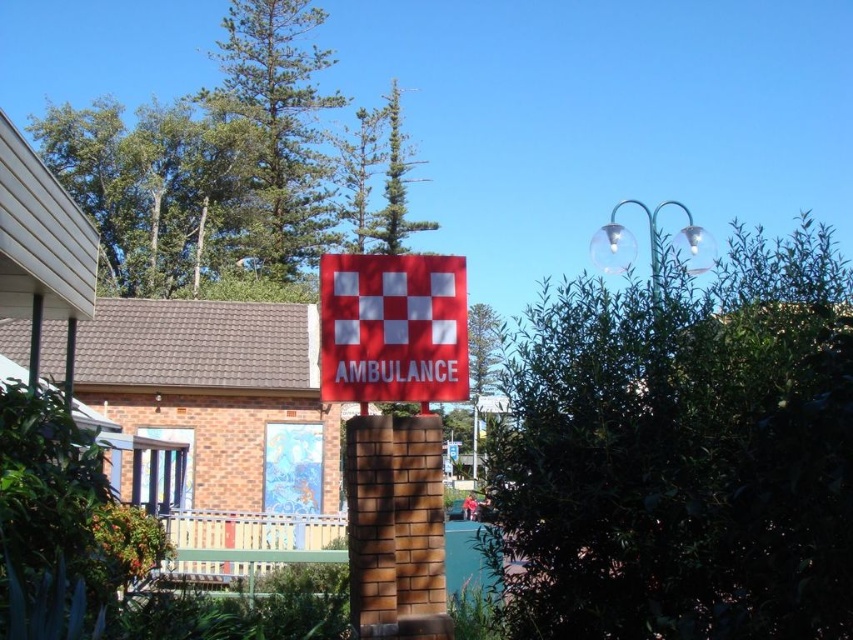
Can you confirm if green leafy tree at upper center is taller than red matte sign at center?

Yes, green leafy tree at upper center is taller than red matte sign at center.

Between point (221, 113) and point (326, 326), which one is positioned in front?

Point (326, 326) is more forward.

Identify the location of green leafy tree at upper center. The image size is (853, 640). (276, 131).

Can you confirm if green leafy bush at center is taller than red matte sign at center?

Yes, green leafy bush at center is taller than red matte sign at center.

Measure the distance between point (581,605) and camera.

The distance of point (581,605) from camera is 2.83 meters.

Is point (555, 500) less distant than point (352, 272)?

Yes.

Locate an element on the screen. The image size is (853, 640). green leafy bush at center is located at coordinates (683, 452).

Does green leafy bush at center have a greater height compared to green leafy tree at upper center?

No.

Which of these two, green leafy bush at center or green leafy tree at upper center, stands taller?

With more height is green leafy tree at upper center.

Where is `green leafy bush at center`? The image size is (853, 640). green leafy bush at center is located at coordinates (683, 452).

Find the location of a particular element. This screenshot has width=853, height=640. green leafy bush at center is located at coordinates (683, 452).